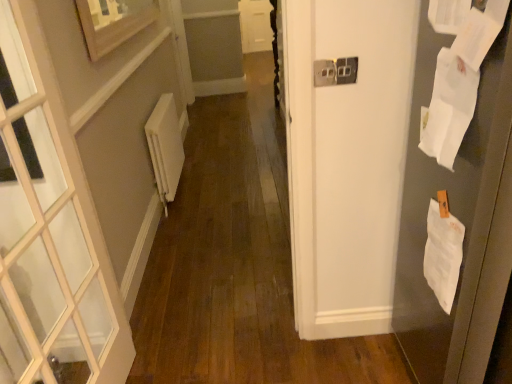
The height and width of the screenshot is (384, 512). Find the location of `vacant area situated below white matte radiator at left (from a real-world perspective)`. vacant area situated below white matte radiator at left (from a real-world perspective) is located at coordinates (177, 196).